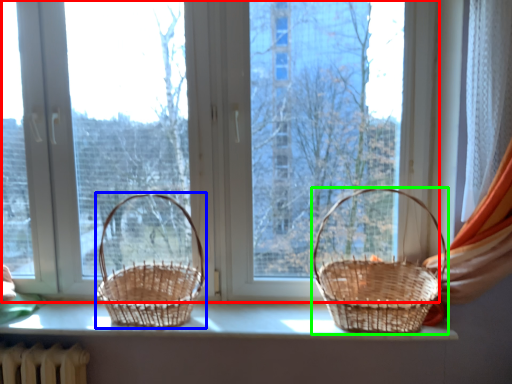
Question: Which object is the farthest from window (highlighted by a red box)? Choose among these: picnic basket (highlighted by a blue box) or picnic basket (highlighted by a green box).

Choices:
 (A) picnic basket
 (B) picnic basket

Answer: (B)